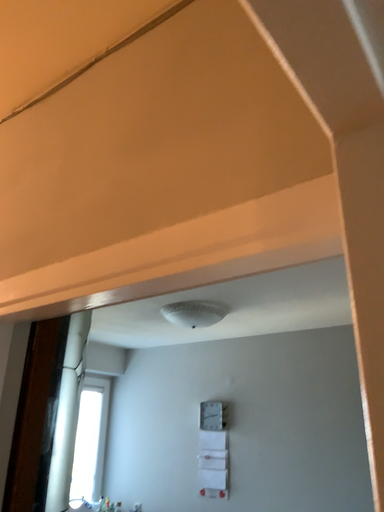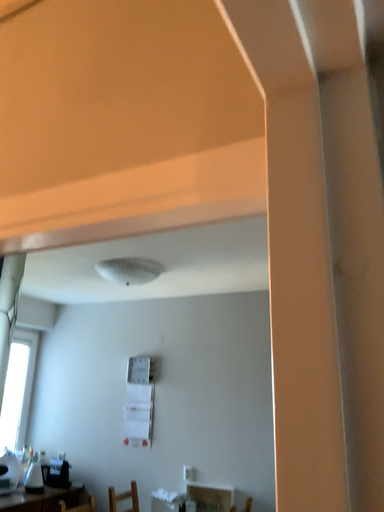
Question: Which way did the camera rotate in the video?

Choices:
 (A) rotated left
 (B) rotated right

Answer: (B)